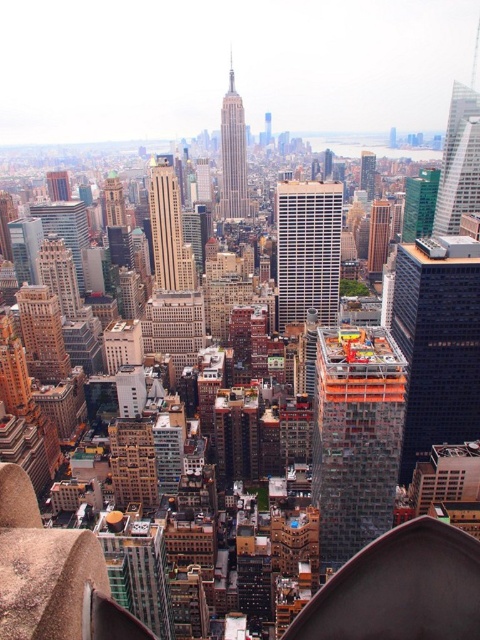
Does white glass building at center have a greater width compared to green glass skyscraper at center?

Correct, the width of white glass building at center exceeds that of green glass skyscraper at center.

Who is positioned more to the right, white glass building at center or green glass skyscraper at center?

Positioned to the right is green glass skyscraper at center.

Describe the element at coordinates (308, 250) in the screenshot. The width and height of the screenshot is (480, 640). I see `white glass building at center` at that location.

At what (x,y) coordinates should I click in order to perform the action: click on white glass building at center. Please return your answer as a coordinate pair (x, y). Looking at the image, I should click on (308, 250).

Does brown brick building at center have a lesser height compared to glassy skyscraper at center?

No, brown brick building at center is not shorter than glassy skyscraper at center.

Locate an element on the screen. brown brick building at center is located at coordinates (377, 237).

Where is `brown brick building at center`? The height and width of the screenshot is (640, 480). brown brick building at center is located at coordinates (377, 237).

Which is more to the left, black glass building at center-right or green glass skyscraper at center?

green glass skyscraper at center is more to the left.

Based on the photo, is black glass building at center-right to the right of green glass skyscraper at center from the viewer's perspective?

Indeed, black glass building at center-right is positioned on the right side of green glass skyscraper at center.

Which is behind, point (433, 284) or point (411, 221)?

Positioned behind is point (411, 221).

You are a GUI agent. You are given a task and a screenshot of the screen. Output one action in this format:
    pyautogui.click(x=<x>, y=<y>)
    Task: Click on the black glass building at center-right
    
    Given the screenshot: What is the action you would take?
    [x=437, y=342]